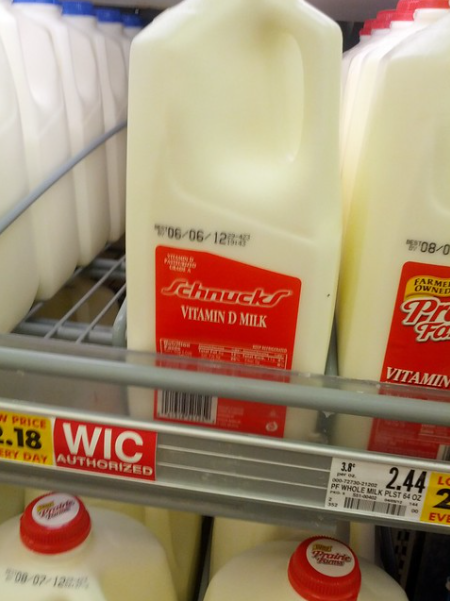
Where is `shelf`? shelf is located at coordinates (136, 380).